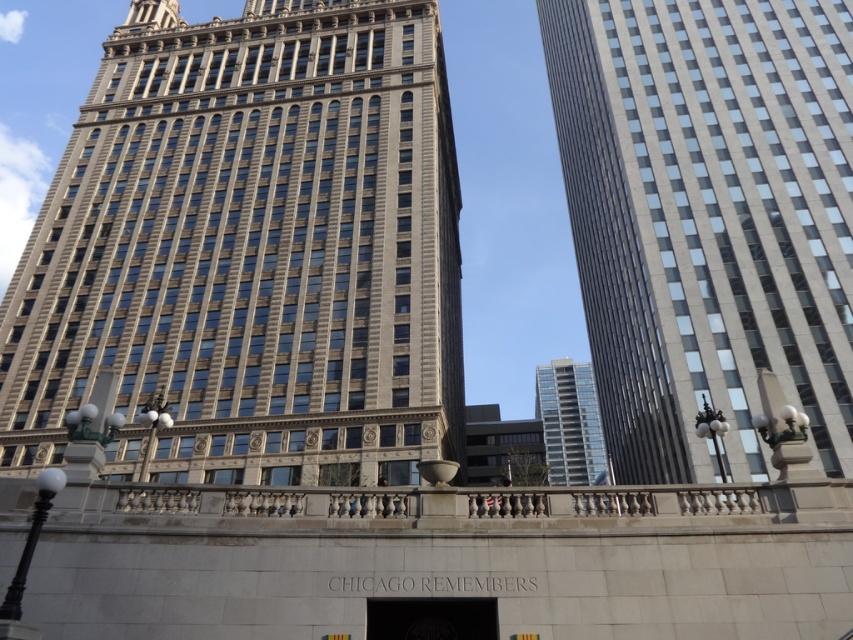
Who is shorter, smooth glass skyscraper at right or silver metallic building at center?

With less height is silver metallic building at center.

Where is `smooth glass skyscraper at right`? This screenshot has height=640, width=853. smooth glass skyscraper at right is located at coordinates 706,218.

From the picture: Between beige stone tower at center and smooth glass skyscraper at right, which one has less height?

Standing shorter between the two is beige stone tower at center.

Between beige stone tower at center and smooth glass skyscraper at right, which one has more height?

With more height is smooth glass skyscraper at right.

Which is behind, point (229, 296) or point (680, 156)?

The point (229, 296) is behind.

Where is `beige stone tower at center`? Image resolution: width=853 pixels, height=640 pixels. beige stone tower at center is located at coordinates (250, 250).

Is the position of beige stone tower at center more distant than that of silver metallic building at center?

No, it is in front of silver metallic building at center.

Where is `beige stone tower at center`? The width and height of the screenshot is (853, 640). beige stone tower at center is located at coordinates (250, 250).